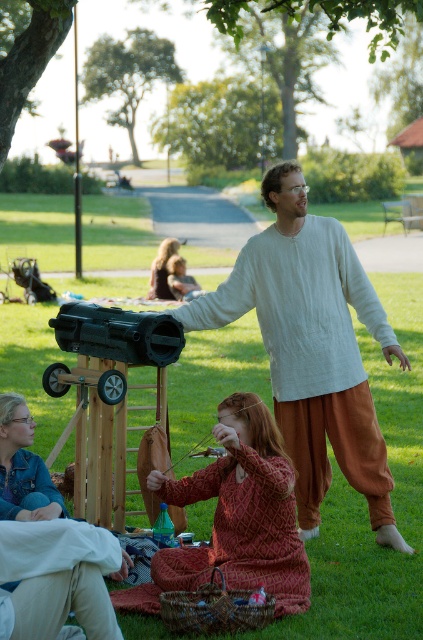
This screenshot has height=640, width=423. Find the location of `green grass at center`. green grass at center is located at coordinates (367, 506).

Which is more to the left, green grass at center or blonde hair at center?

From the viewer's perspective, blonde hair at center appears more on the left side.

Find the location of a particular element. green grass at center is located at coordinates (367, 506).

This screenshot has width=423, height=640. Identify the location of green grass at center. (367, 506).

Can you confirm if light beige linen shirt at center is bigger than blonde hair at center?

Yes.

Is light beige linen shirt at center positioned in front of blonde hair at center?

Yes.

Is point (329, 262) closer to camera compared to point (167, 294)?

Yes, it is in front of point (167, 294).

Identify the location of light beige linen shirt at center. The width and height of the screenshot is (423, 640). (312, 348).

Who is higher up, green grass at center or red textured dress at center?

Positioned higher is green grass at center.

At what (x,y) coordinates should I click in order to perform the action: click on green grass at center. Please return your answer as a coordinate pair (x, y). Image resolution: width=423 pixels, height=640 pixels. Looking at the image, I should click on (367, 506).

Where is `green grass at center`? The image size is (423, 640). green grass at center is located at coordinates (367, 506).